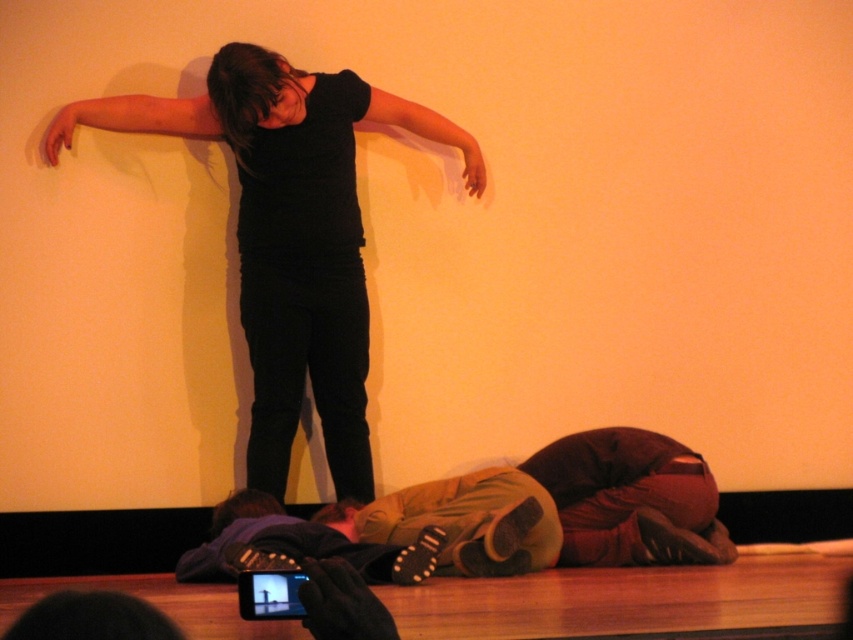
Describe the element at coordinates (428, 132) in the screenshot. I see `black matte arm at upper center` at that location.

Based on the photo, is black matte arm at upper center to the right of matte black hand at upper center from the viewer's perspective?

No, black matte arm at upper center is not to the right of matte black hand at upper center.

At what (x,y) coordinates should I click in order to perform the action: click on black matte arm at upper center. Please return your answer as a coordinate pair (x, y). The width and height of the screenshot is (853, 640). Looking at the image, I should click on (428, 132).

You are a GUI agent. You are given a task and a screenshot of the screen. Output one action in this format:
    pyautogui.click(x=<x>, y=<y>)
    Task: Click on the black matte arm at upper center
    Image resolution: width=853 pixels, height=640 pixels.
    Given the screenshot: What is the action you would take?
    pyautogui.click(x=428, y=132)

Is brown fabric sleeping bag at lower center to the left of matte black arm at upper left from the viewer's perspective?

In fact, brown fabric sleeping bag at lower center is to the right of matte black arm at upper left.

Which is above, brown fabric sleeping bag at lower center or matte black arm at upper left?

matte black arm at upper left is above.

This screenshot has width=853, height=640. What do you see at coordinates (569, 504) in the screenshot?
I see `brown fabric sleeping bag at lower center` at bounding box center [569, 504].

At what (x,y) coordinates should I click in order to perform the action: click on brown fabric sleeping bag at lower center. Please return your answer as a coordinate pair (x, y). This screenshot has width=853, height=640. Looking at the image, I should click on (569, 504).

Can you confirm if matte black hand at upper left is thinner than matte black hand at upper center?

No.

Who is positioned more to the right, matte black hand at upper left or matte black hand at upper center?

matte black hand at upper center

Which is behind, point (44, 132) or point (480, 188)?

The point (480, 188) is more distant.

Where is `matte black hand at upper left`? The width and height of the screenshot is (853, 640). matte black hand at upper left is located at coordinates (59, 132).